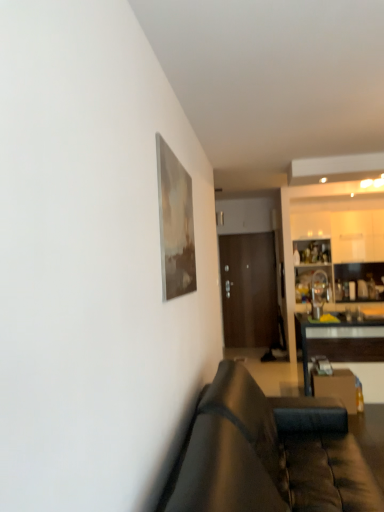
Question: In the image, is white glossy cabinetry at right on the left side or the right side of brown wooden door at center?

Choices:
 (A) right
 (B) left

Answer: (A)

Question: In terms of width, does white glossy cabinetry at right look wider or thinner when compared to brown wooden door at center?

Choices:
 (A) wide
 (B) thin

Answer: (B)

Question: Based on their relative distances, which object is farther from the leather couch at lower right?

Choices:
 (A) white glossy cabinetry at right
 (B) black glossy table at right
 (C) brown wooden door at center

Answer: (C)

Question: Which object is the closest to the white glossy cabinetry at right?

Choices:
 (A) brown wooden door at center
 (B) leather couch at lower right
 (C) black glossy table at right

Answer: (A)